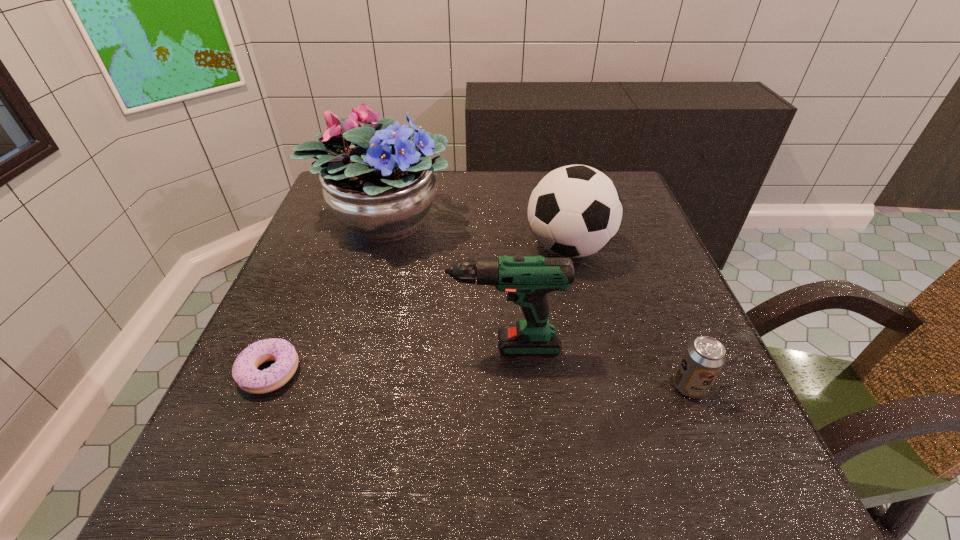
Identify the location of bouquet. This screenshot has height=540, width=960. (381, 189).

Locate an element on the screen. drill is located at coordinates (527, 279).

Locate an element on the screen. This screenshot has height=540, width=960. soccer ball is located at coordinates (574, 211).

Where is `the second shortest object`? This screenshot has height=540, width=960. the second shortest object is located at coordinates (704, 357).

Find the location of a particular element. Image resolution: width=960 pixels, height=540 pixels. the rightmost object is located at coordinates (704, 357).

This screenshot has width=960, height=540. What are the coordinates of `the shortest object` in the screenshot? It's located at (245, 372).

The height and width of the screenshot is (540, 960). In order to click on vacant space situated on the right of the bouquet in this screenshot , I will do `click(552, 219)`.

Find the location of a particular element. The height and width of the screenshot is (540, 960). vacant space located on the handle side of the drill is located at coordinates (389, 347).

The width and height of the screenshot is (960, 540). Find the location of `blank area located 0.170m on the handle side of the drill`. blank area located 0.170m on the handle side of the drill is located at coordinates (334, 347).

Find the location of `free space located 0.200m on the handle side of the drill`. free space located 0.200m on the handle side of the drill is located at coordinates (318, 347).